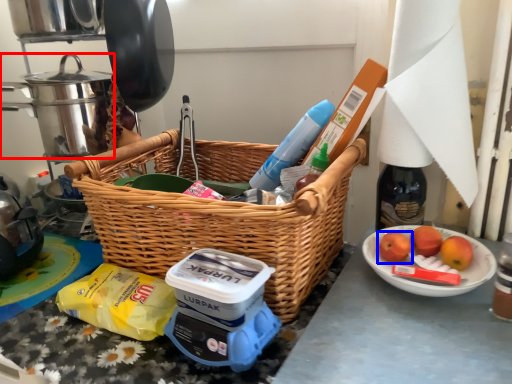
Question: Which object appears closest to the camera in this image, crock pot (highlighted by a red box) or apple (highlighted by a blue box)?

Choices:
 (A) crock pot
 (B) apple

Answer: (B)